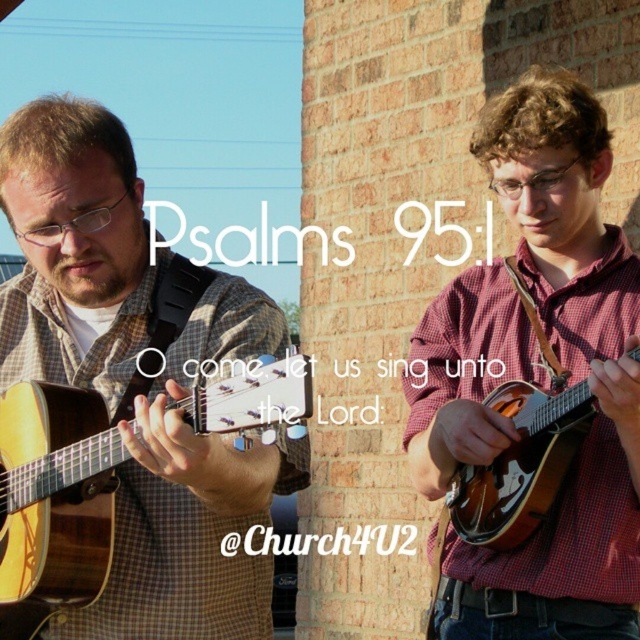
You are a photographer setting up for a shoot. You need to place a microphone stand between the acoustic wood guitar at left and the wooden mandolin at right. Since you want the stand to be closer to the taller instrument, where should you position it?

The acoustic wood guitar at left is taller than the wooden mandolin at right, so you should position the microphone stand closer to the acoustic wood guitar at left.

Looking at this image, based on the scene description, which musical instrument is placed lower in the image? The acoustic wood guitar at left or the wooden mandolin at right?

The acoustic wood guitar at left is positioned under the wooden mandolin at right, so it is placed lower in the image.

You are a photographer standing at the center of the scene. You want to take a photo that includes both the acoustic wood guitar at left and the wooden mandolin at right. What is the minimum distance you need to move forward to ensure both instruments are in frame?

The acoustic wood guitar at left is 18.82 feet away from the wooden mandolin at right. To include both in the frame, you need to move forward until you are at least 18.82 feet away from the closest instrument, ensuring both are within the camera view.